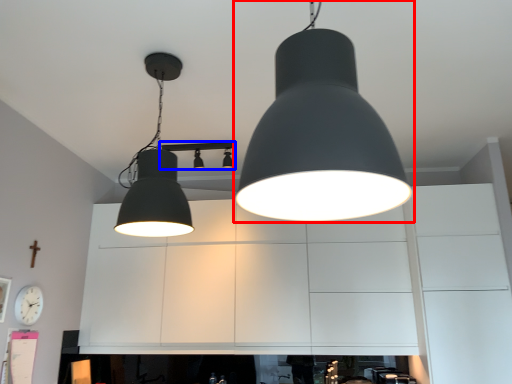
Question: Which object is further to the camera taking this photo, lamp (highlighted by a red box) or lamp (highlighted by a blue box)?

Choices:
 (A) lamp
 (B) lamp

Answer: (B)